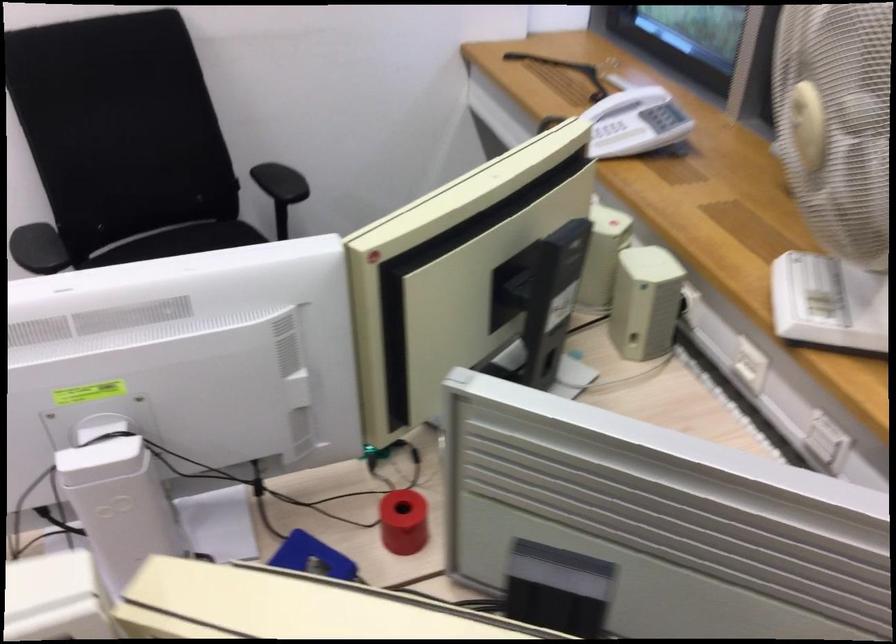
This screenshot has height=644, width=896. What do you see at coordinates (179, 240) in the screenshot?
I see `the chair sitting surface` at bounding box center [179, 240].